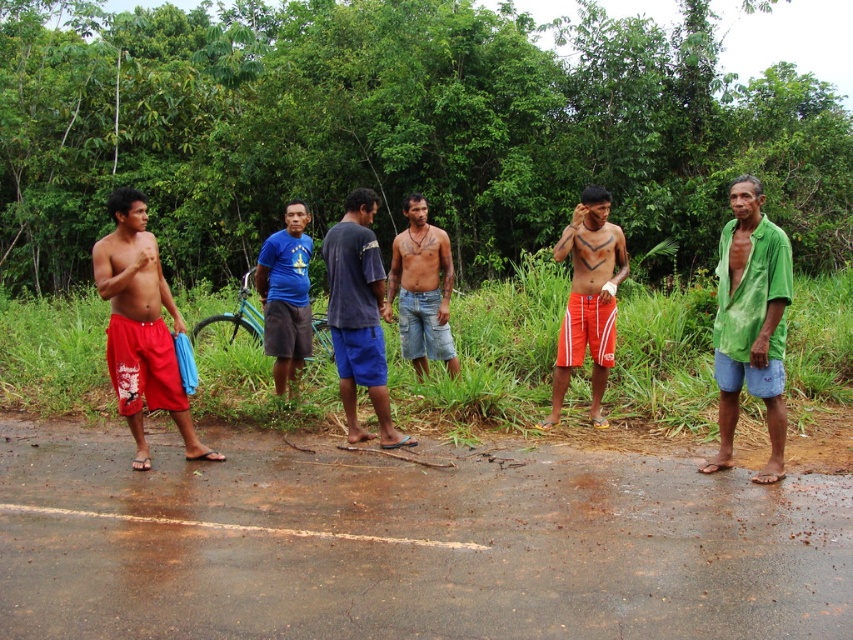
Question: Can you confirm if orange shorts at center is positioned to the right of blue fabric shirt at center?

Choices:
 (A) yes
 (B) no

Answer: (A)

Question: Which point is farther from the camera taking this photo?

Choices:
 (A) (437, 307)
 (B) (372, 250)
 (C) (722, 268)

Answer: (A)

Question: Which object is positioned closest to the blue fabric shirt at center?

Choices:
 (A) dark blue cotton shirt at center
 (B) orange shorts at center
 (C) red cotton shorts at left
 (D) green satin shirt at right

Answer: (A)

Question: Considering the real-world distances, which object is farthest from the orange shorts at center?

Choices:
 (A) blue denim shorts at center
 (B) green satin shirt at right
 (C) blue fabric shirt at center

Answer: (C)

Question: Considering the relative positions of green satin shirt at right and orange shorts at center in the image provided, where is green satin shirt at right located with respect to orange shorts at center?

Choices:
 (A) below
 (B) above

Answer: (A)

Question: Does dark blue cotton shirt at center appear on the left side of blue fabric shirt at center?

Choices:
 (A) no
 (B) yes

Answer: (A)